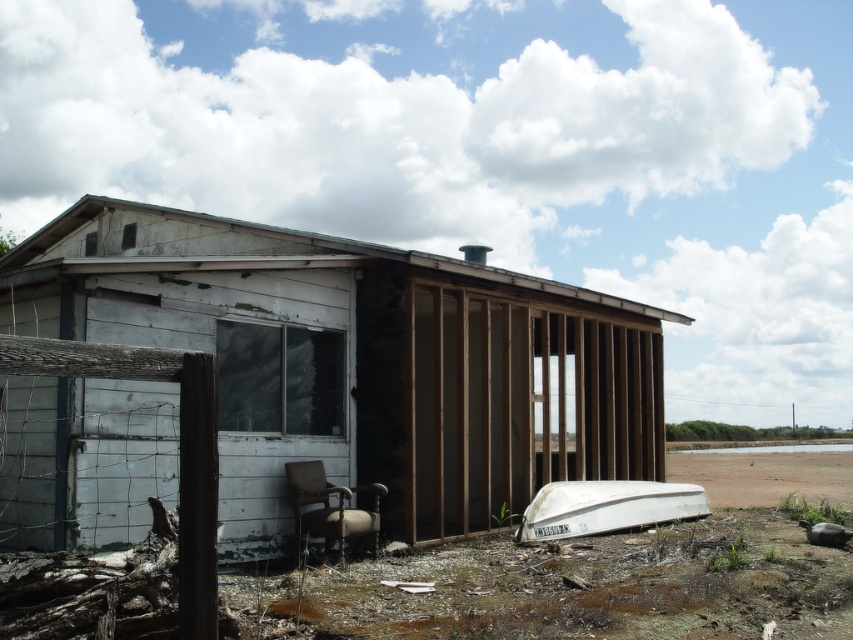
You are standing in front of the building and want to place a small potted plant between the brown sandy dirt at lower right and the white matte boat at lower right. Based on their positions, which object should the plant be closer to?

The brown sandy dirt at lower right is closer to you than the white matte boat at lower right, so the plant should be placed closer to the white matte boat at lower right to be between them.

You are a construction worker assessing the site. The white wood hut at center is an existing structure, and the brown sandy dirt at lower right is the proposed area for expansion. Based on their sizes, which area would require more materials for the expansion project?

The brown sandy dirt at lower right would require more materials for the expansion project since it has a larger size compared to the white wood hut at center.